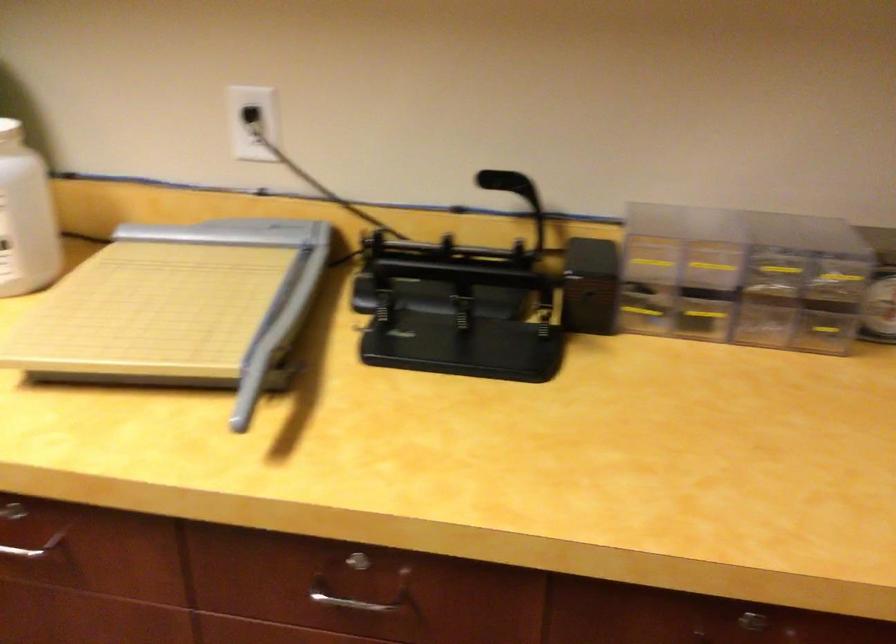
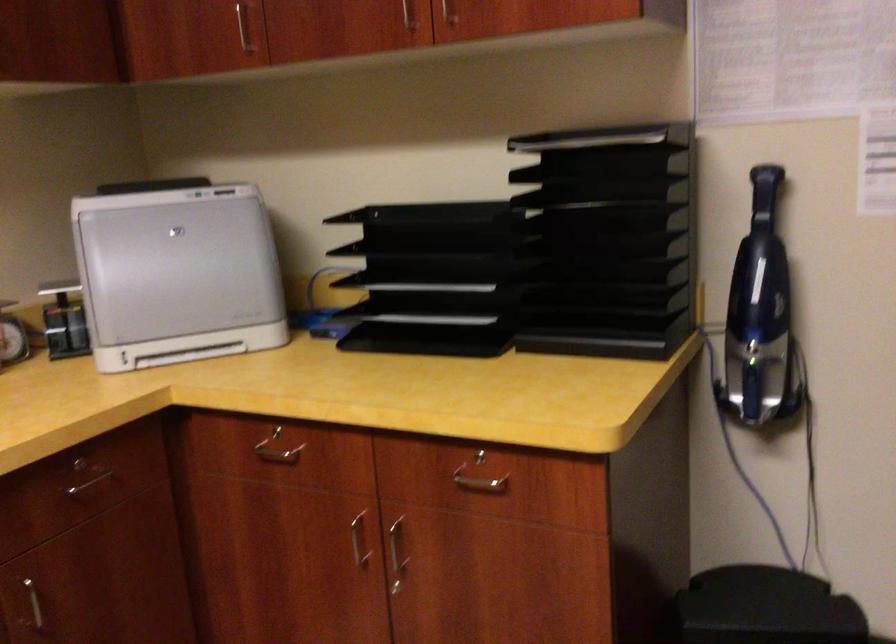
Question: How did the camera likely rotate?

Choices:
 (A) Left
 (B) Right
 (C) Up
 (D) Down

Answer: (B)